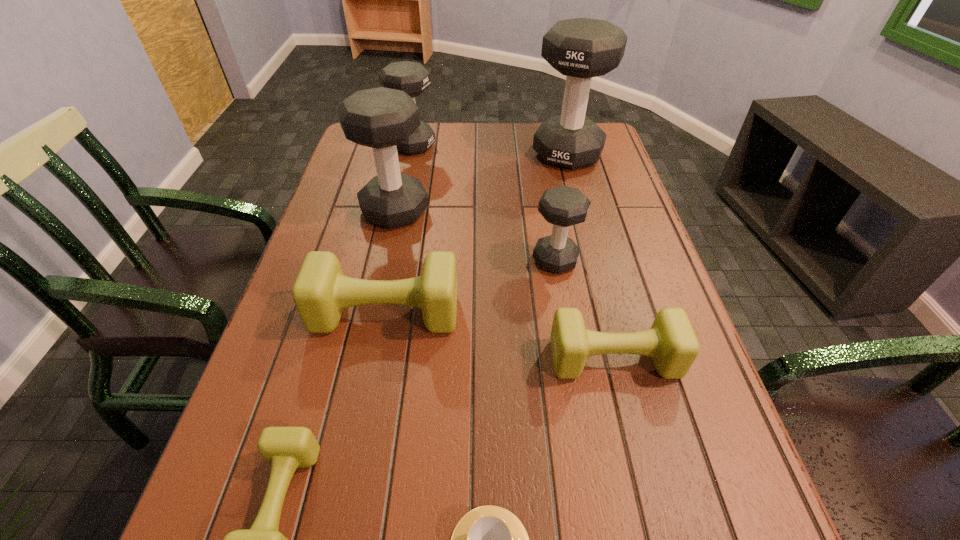
The image size is (960, 540). Find the location of `the sixth farthest object`. the sixth farthest object is located at coordinates (671, 342).

Find the location of a particular element. This screenshot has height=540, width=960. the second smallest olive dumbbell is located at coordinates (671, 342).

Locate an element on the screen. Image resolution: width=960 pixels, height=540 pixels. free location located on the back of the tallest object is located at coordinates (560, 125).

The image size is (960, 540). I want to click on vacant area situated 0.340m on the back of the third farthest dumbbell, so click(412, 131).

At what (x,y) coordinates should I click in order to perform the action: click on free space located on the front of the second smallest gray dumbbell. Please return your answer as a coordinate pair (x, y). Looking at the image, I should click on (408, 167).

Identify the location of free location located on the right of the nearest gray dumbbell. (637, 260).

This screenshot has width=960, height=540. I want to click on vacant space situated on the front of the fourth shortest object, so click(375, 367).

This screenshot has height=540, width=960. Identify the location of vacant region located 0.160m on the front of the second farthest olive dumbbell. (641, 471).

Image resolution: width=960 pixels, height=540 pixels. I want to click on object situated at the far left corner, so click(x=413, y=78).

Where is `object present at the far right corner`? The width and height of the screenshot is (960, 540). object present at the far right corner is located at coordinates (581, 48).